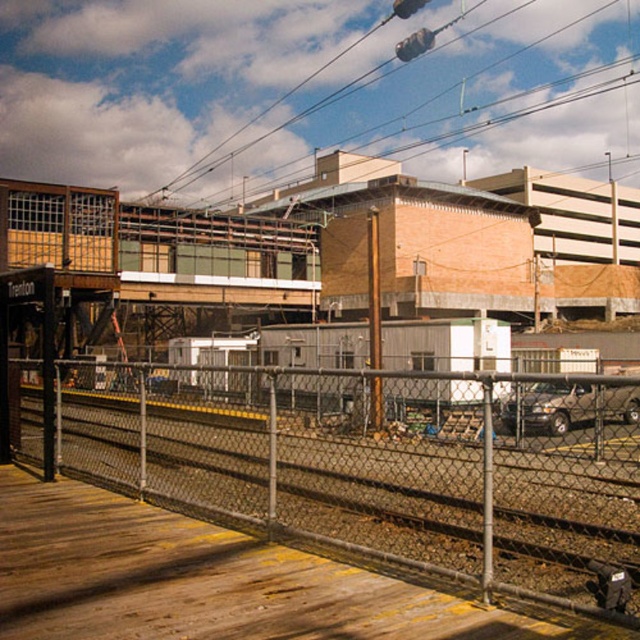
Question: Where is metal chain-link fence at center located in relation to metallic wire at upper center in the image?

Choices:
 (A) right
 (B) left

Answer: (B)

Question: Does metal chain-link fence at center have a larger size compared to metallic wire at upper center?

Choices:
 (A) yes
 (B) no

Answer: (B)

Question: Among these points, which one is nearest to the camera?

Choices:
 (A) pos(307,406)
 (B) pos(500,42)

Answer: (A)

Question: Is metal chain-link fence at center above metallic wire at upper center?

Choices:
 (A) yes
 (B) no

Answer: (B)

Question: Which object appears farthest from the camera in this image?

Choices:
 (A) metal chain-link fence at center
 (B) metallic wire at upper center

Answer: (B)